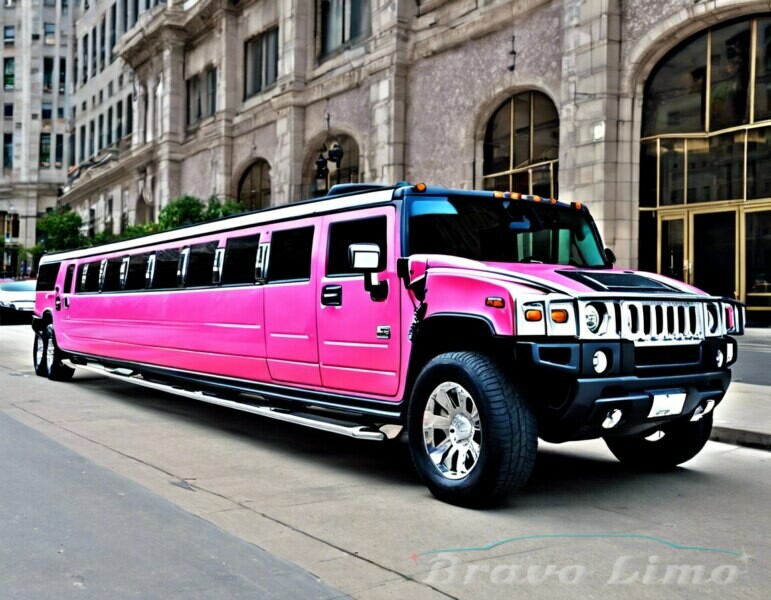
Find the location of a particular element. Image resolution: width=771 pixels, height=600 pixels. window is located at coordinates (44, 275), (96, 282), (120, 279), (143, 278), (183, 280), (163, 283), (243, 269), (290, 266), (362, 229).